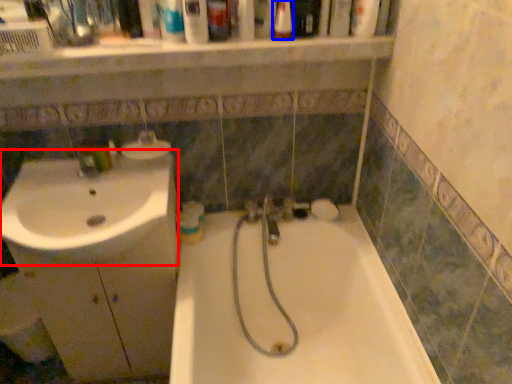
Question: Which of the following is the farthest to the observer, sink (highlighted by a red box) or mouthwash (highlighted by a blue box)?

Choices:
 (A) sink
 (B) mouthwash

Answer: (A)